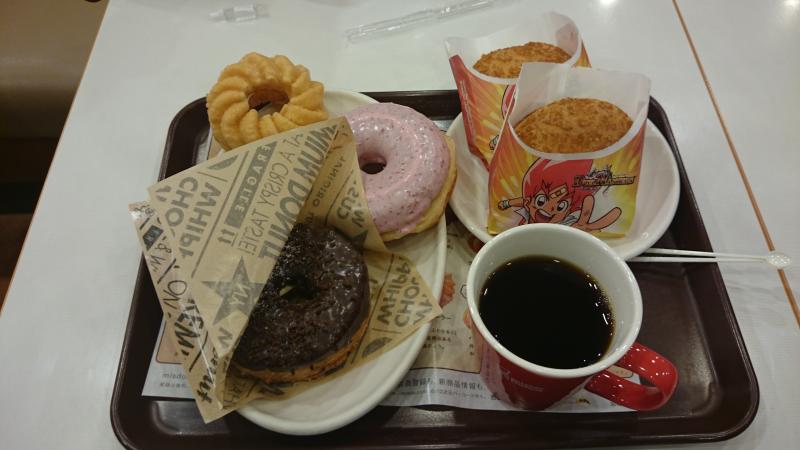
Find the location of a particular element. Image resolution: width=800 pixels, height=450 pixels. coffee stirrer is located at coordinates (661, 255).